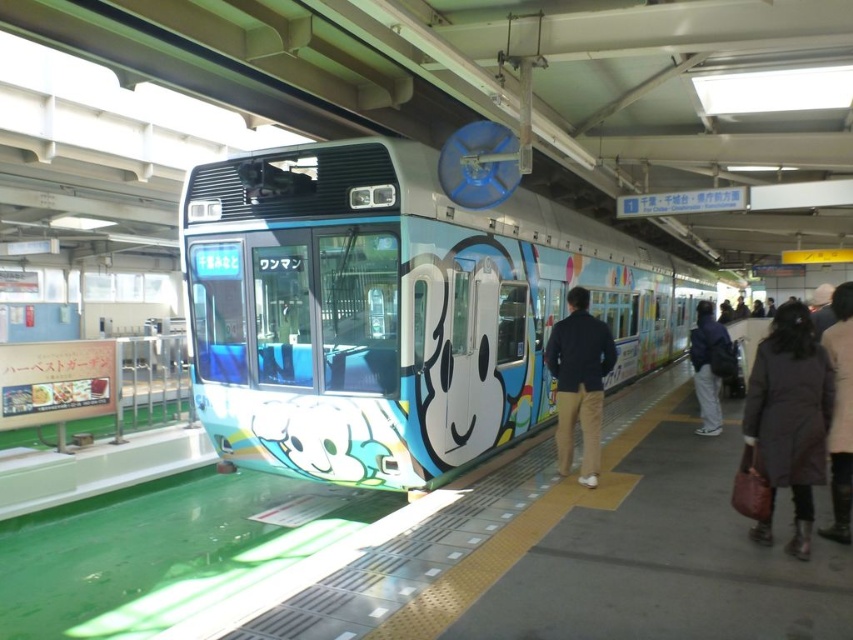
Question: Which is farther from the light gray pants at right?

Choices:
 (A) brown leather bag at lower right
 (B) matte blue train at center
 (C) dark blue jacket at center

Answer: (A)

Question: Among these points, which one is farthest from the camera?

Choices:
 (A) (704, 365)
 (B) (798, 372)
 (C) (318, 324)
 (D) (567, 417)

Answer: (A)

Question: Which point is closer to the camera?

Choices:
 (A) (775, 371)
 (B) (834, 483)
 (C) (577, 317)

Answer: (A)

Question: Can you confirm if matte blue train at center is positioned above light gray pants at right?

Choices:
 (A) no
 (B) yes

Answer: (B)

Question: Is brown leather bag at lower right thinner than brown quilted coat at right?

Choices:
 (A) yes
 (B) no

Answer: (B)

Question: Is matte blue train at center to the right of dark blue jacket at center from the viewer's perspective?

Choices:
 (A) yes
 (B) no

Answer: (A)